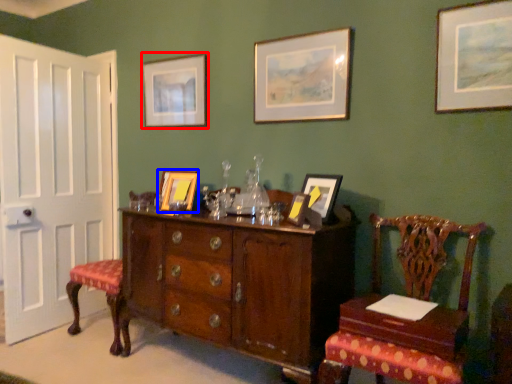
Question: Among these objects, which one is farthest to the camera, picture frame (highlighted by a red box) or picture frame (highlighted by a blue box)?

Choices:
 (A) picture frame
 (B) picture frame

Answer: (A)